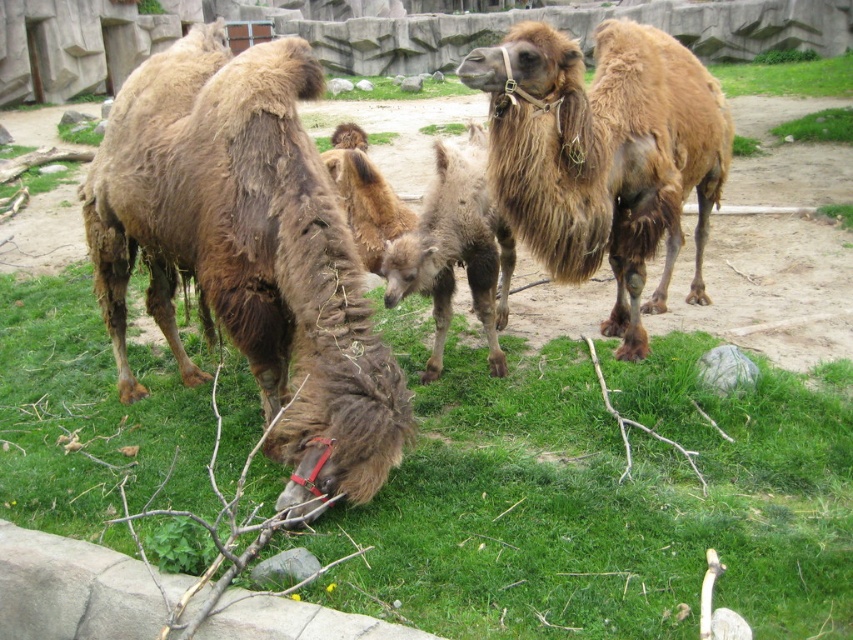
Who is more distant from viewer, (625, 67) or (358, 170)?

Positioned behind is point (625, 67).

Which is more to the left, brown fuzzy camel at upper right or fuzzy brown camel at center?

From the viewer's perspective, fuzzy brown camel at center appears more on the left side.

Is point (669, 38) farther from camera compared to point (494, 337)?

Yes, point (669, 38) is behind point (494, 337).

Find the location of `brown fuzzy camel at upper right`. brown fuzzy camel at upper right is located at coordinates (602, 156).

Between point (637, 568) and point (602, 236), which one is positioned behind?

Point (602, 236)

Can you confirm if green grass at lower left is positioned to the right of brown fuzzy camel at upper right?

Incorrect, green grass at lower left is not on the right side of brown fuzzy camel at upper right.

This screenshot has height=640, width=853. What do you see at coordinates (601, 497) in the screenshot?
I see `green grass at lower left` at bounding box center [601, 497].

At what (x,y) coordinates should I click in order to perform the action: click on green grass at lower left. Please return your answer as a coordinate pair (x, y). Image resolution: width=853 pixels, height=640 pixels. Looking at the image, I should click on pos(601,497).

Does brown fuzzy camel at left come behind brown fuzzy camel at upper right?

No, brown fuzzy camel at left is closer to the viewer.

Is brown fuzzy camel at left above brown fuzzy camel at upper right?

No.

Is point (314, 362) positioned after point (643, 252)?

No, (314, 362) is closer to viewer.

Where is `brown fuzzy camel at left`? This screenshot has height=640, width=853. brown fuzzy camel at left is located at coordinates (247, 252).